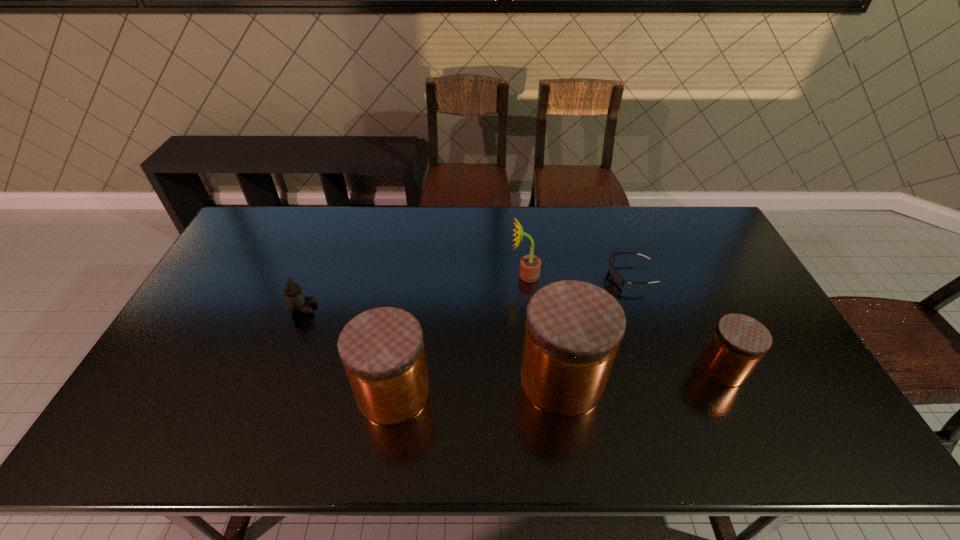
Where is `vacant area that lies between the rightmost jar and the second jar from left to right`? The image size is (960, 540). vacant area that lies between the rightmost jar and the second jar from left to right is located at coordinates (642, 373).

This screenshot has height=540, width=960. Find the location of `free spot between the second jar from right to left and the rightmost jar`. free spot between the second jar from right to left and the rightmost jar is located at coordinates (642, 373).

This screenshot has height=540, width=960. Find the location of `vacant space that's between the teddy bear and the shortest object`. vacant space that's between the teddy bear and the shortest object is located at coordinates (467, 292).

This screenshot has width=960, height=540. What are the coordinates of `free space between the second jar from left to right and the third shortest object` in the screenshot? It's located at (642, 373).

This screenshot has width=960, height=540. Identify the location of vacant area that lies between the sunflower and the teddy bear. (414, 292).

Identify the location of free space between the goggles and the fifth object from right to left. (512, 333).

Identify which object is located as the second nearest to the leftmost jar. Please provide its 2D coordinates. Your answer should be formatted as a tuple, i.e. [(x, y)], where the tuple contains the x and y coordinates of a point satisfying the conditions above.

[(295, 300)]

The width and height of the screenshot is (960, 540). What are the coordinates of `object identified as the closest to the second jar from left to right` in the screenshot? It's located at (530, 265).

Where is `jar that is the third nearest to the sunflower`? The width and height of the screenshot is (960, 540). jar that is the third nearest to the sunflower is located at coordinates pyautogui.click(x=738, y=342).

Point out which jar is positioned as the second nearest to the second tallest jar. Please provide its 2D coordinates. Your answer should be formatted as a tuple, i.e. [(x, y)], where the tuple contains the x and y coordinates of a point satisfying the conditions above.

[(738, 342)]